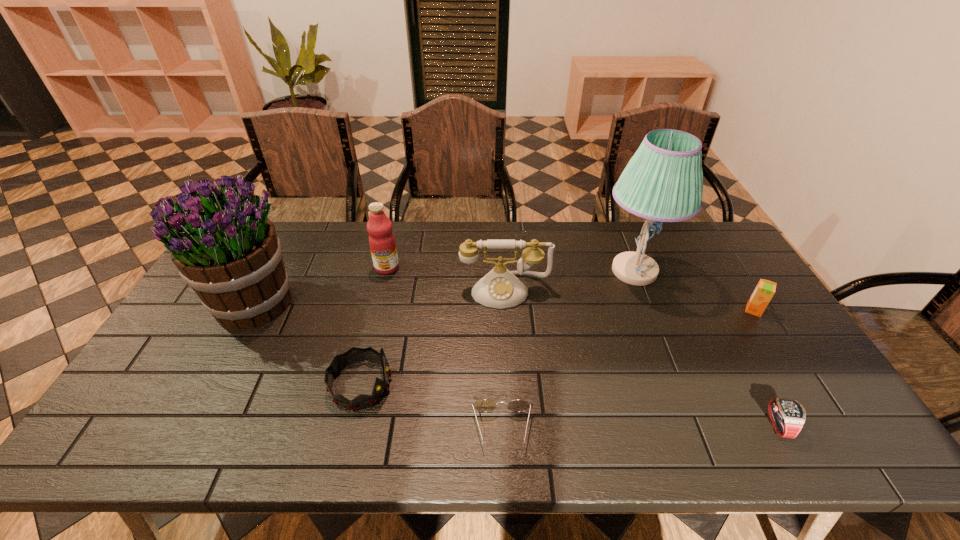
I want to click on free spot between the telephone and the sixth shortest object, so click(445, 279).

The image size is (960, 540). Identify the location of vacant area that lies between the fruit juice and the tiara. (373, 326).

You are a GUI agent. You are given a task and a screenshot of the screen. Output one action in this format:
    pyautogui.click(x=<x>, y=<y>)
    Task: Click on the vacant space that is in between the watch and the fruit juice
    
    Given the screenshot: What is the action you would take?
    pyautogui.click(x=581, y=346)

This screenshot has height=540, width=960. Find the location of `vacant space that is in between the telephone and the fruit juice`. vacant space that is in between the telephone and the fruit juice is located at coordinates (445, 279).

Identify the location of empty space between the tiara and the leftmost object. Image resolution: width=960 pixels, height=540 pixels. (306, 343).

Where is `free point between the sixth shortest object and the telephone`? free point between the sixth shortest object and the telephone is located at coordinates (445, 279).

You are a GUI agent. You are given a task and a screenshot of the screen. Output one action in this format:
    pyautogui.click(x=<x>, y=<y>)
    Task: Click on the vacant region between the third object from right to left and the bouquet
    This screenshot has width=960, height=540.
    Given the screenshot: What is the action you would take?
    pyautogui.click(x=444, y=287)

This screenshot has width=960, height=540. I want to click on vacant space that is in between the bouquet and the seventh tallest object, so click(x=514, y=364).

Where is `free point between the leftmost object and the shortest object`? This screenshot has width=960, height=540. free point between the leftmost object and the shortest object is located at coordinates (377, 366).

Identify the location of object that stands as the sixth closest to the tiara. (787, 416).